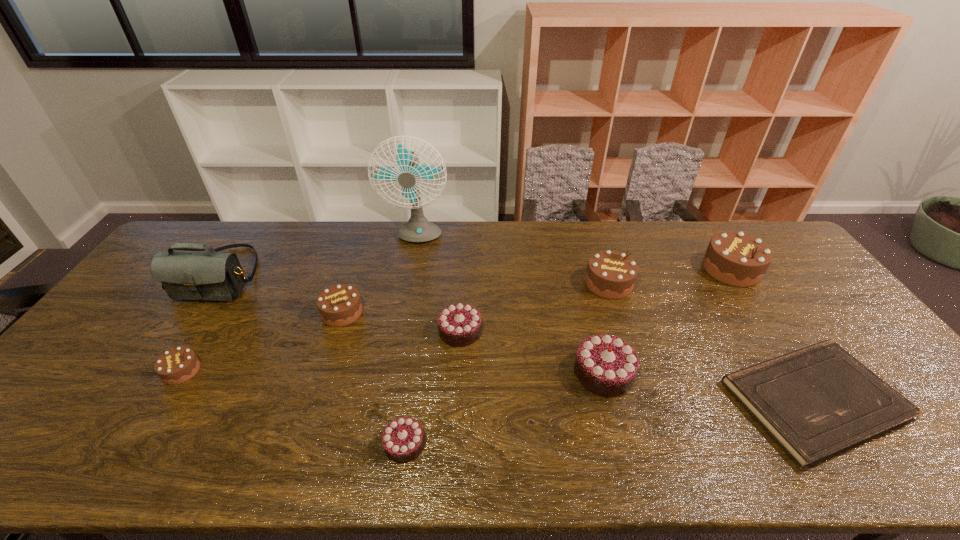
Locate which brown chocolate cake is the closest to the rightmost brown chocolate cake. Please provide its 2D coordinates. Your answer should be formatted as a tuple, i.e. [(x, y)], where the tuple contains the x and y coordinates of a point satisfying the conditions above.

[(610, 274)]

Locate which chocolate chocolate cake ranks second in proximity to the fourth chocolate cake from left to right. Please provide its 2D coordinates. Your answer should be formatted as a tuple, i.e. [(x, y)], where the tuple contains the x and y coordinates of a point satisfying the conditions above.

[(605, 365)]

Choose which chocolate chocolate cake is the second nearest neighbor to the second biggest chocolate chocolate cake. Please provide its 2D coordinates. Your answer should be formatted as a tuple, i.e. [(x, y)], where the tuple contains the x and y coordinates of a point satisfying the conditions above.

[(605, 365)]

Where is `vacant space that satisfies the following two spatial constraints: 1. on the front-facing side of the second biggest brown chocolate cake; 2. on the left side of the fan`? Image resolution: width=960 pixels, height=540 pixels. vacant space that satisfies the following two spatial constraints: 1. on the front-facing side of the second biggest brown chocolate cake; 2. on the left side of the fan is located at coordinates (409, 284).